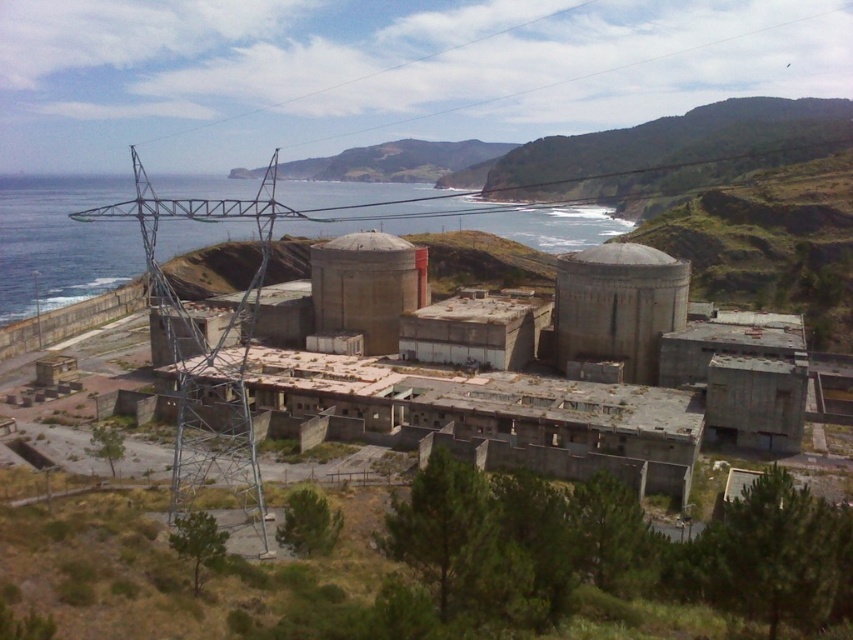
You are standing at the base of the transmission tower on the left side of the industrial complex. You notice two points marked in the image. Which point, point (656,308) or point (337,278), is closer to your current position?

Point (656,308) is closer to the camera than point (337,278), so it is closer to your current position at the base of the transmission tower.